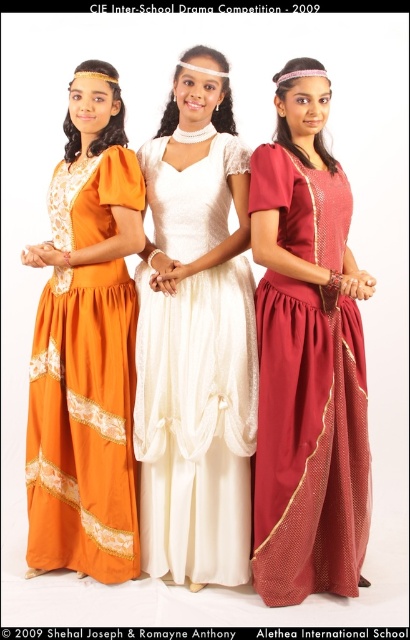
Who is positioned more to the left, matte red dress at center or orange lace dress at left?

From the viewer's perspective, orange lace dress at left appears more on the left side.

Is point (337, 308) positioned behind point (77, 508)?

No.

Where is `matte red dress at center`? matte red dress at center is located at coordinates (307, 358).

Is point (295, 109) farther from camera compared to point (239, 436)?

No, (295, 109) is closer to viewer.

Is matte red dress at center closer to camera compared to white satin dress at center?

Yes, it is in front of white satin dress at center.

Measure the distance between matte red dress at center and camera.

matte red dress at center is 1.85 meters away from camera.

You are a GUI agent. You are given a task and a screenshot of the screen. Output one action in this format:
    pyautogui.click(x=<x>, y=<y>)
    Task: Click on the matte red dress at center
    
    Given the screenshot: What is the action you would take?
    pyautogui.click(x=307, y=358)

Find the location of `white satin dress at center`. white satin dress at center is located at coordinates (195, 422).

Who is shorter, white satin dress at center or orange lace dress at left?

With less height is orange lace dress at left.

Measure the distance between white satin dress at center and camera.

white satin dress at center and camera are 6.57 feet apart from each other.

Locate an element on the screen. This screenshot has height=640, width=410. white satin dress at center is located at coordinates (195, 422).